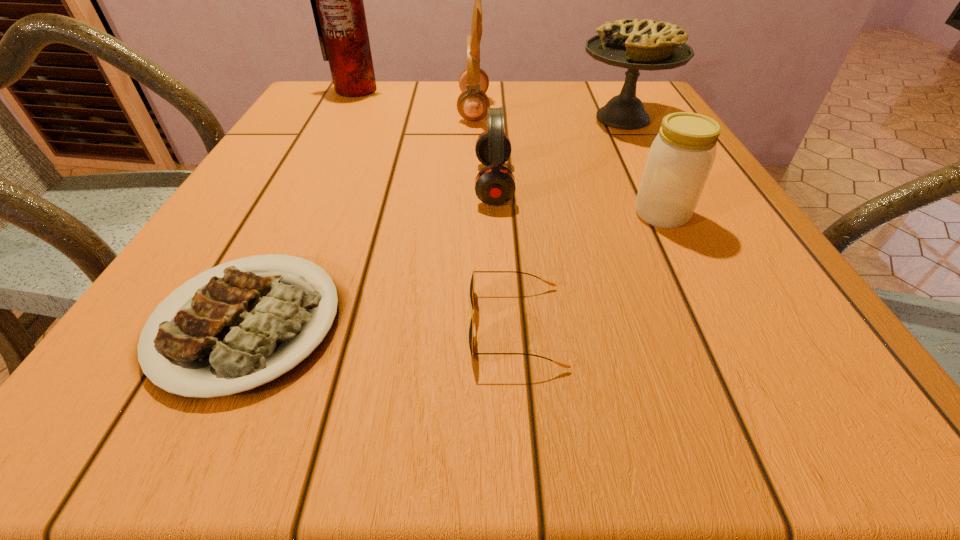
This screenshot has height=540, width=960. I want to click on vacant point located between the plate and the sixth shortest object, so click(361, 217).

Where is `unoccupied position between the jar and the fifth shortest object`? The height and width of the screenshot is (540, 960). unoccupied position between the jar and the fifth shortest object is located at coordinates click(642, 166).

Where is `free point between the farther earphone and the pie`? Image resolution: width=960 pixels, height=540 pixels. free point between the farther earphone and the pie is located at coordinates (548, 113).

Locate an element on the screen. Image resolution: width=960 pixels, height=540 pixels. free spot between the shorter earphone and the jar is located at coordinates (578, 199).

You are a GUI agent. You are given a task and a screenshot of the screen. Output one action in this format:
    pyautogui.click(x=<x>, y=<y>)
    Task: Click on the unoccupied position between the jar and the sunglasses
    
    Given the screenshot: What is the action you would take?
    pyautogui.click(x=588, y=270)

Find the location of a particular element. vacant space that is in between the fifth shortest object and the nearer earphone is located at coordinates (558, 151).

Locate an element on the screen. vacant space that's between the plate and the tallest object is located at coordinates (301, 207).

The width and height of the screenshot is (960, 540). I want to click on vacant space in between the jar and the sixth shortest object, so click(567, 161).

Locate an element on the screen. free spot between the jar and the pie is located at coordinates (642, 166).

In order to click on object that stands as the closest to the pie in this screenshot , I will do `click(495, 184)`.